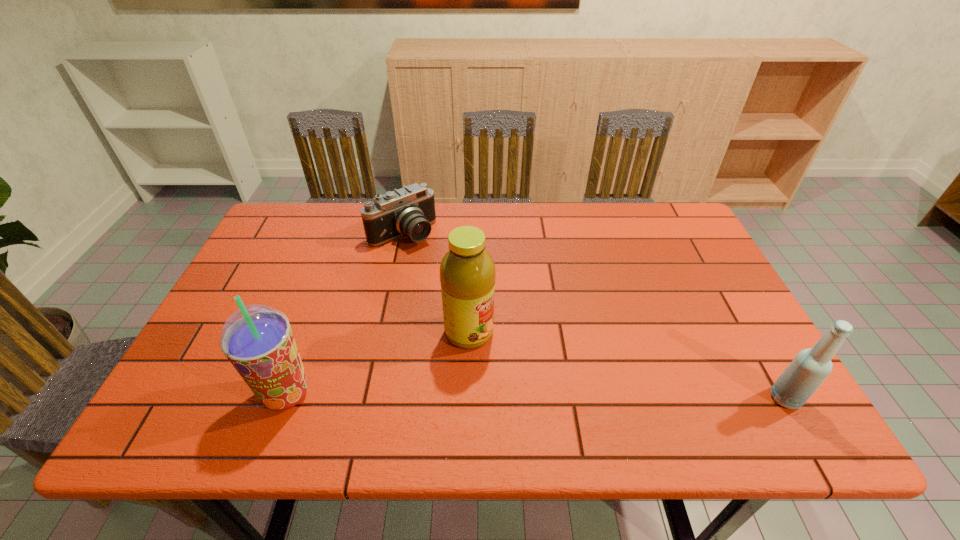
Locate an element on the screen. smoothie is located at coordinates (257, 339).

Find the location of a particular element. the second shortest object is located at coordinates (810, 367).

The image size is (960, 540). In order to click on bottle in this screenshot , I will do `click(810, 367)`.

Image resolution: width=960 pixels, height=540 pixels. In order to click on the second object from right to left in this screenshot , I will do `click(467, 271)`.

I want to click on fruit juice, so click(x=467, y=271).

Where is `the shortest object`? Image resolution: width=960 pixels, height=540 pixels. the shortest object is located at coordinates (409, 211).

Locate an element on the screen. This screenshot has height=540, width=960. the third object from right to left is located at coordinates (409, 211).

At what (x,y) coordinates should I click in order to perform the action: click on free space located 0.180m on the left of the leftmost object. Please return your answer as a coordinate pair (x, y). Image resolution: width=960 pixels, height=540 pixels. Looking at the image, I should click on (174, 394).

Identify the location of free space located on the back of the rightmost object. (718, 281).

The height and width of the screenshot is (540, 960). What are the coordinates of `vacant space located on the front label of the third nearest object` in the screenshot? It's located at (535, 373).